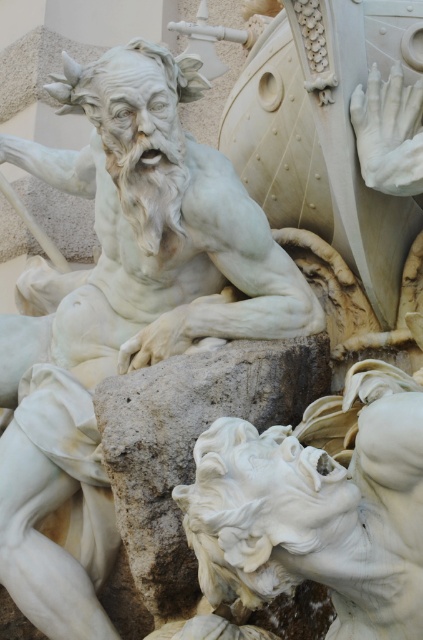
Does point (235, 276) come behind point (302, 390)?

Yes, it is.

Is white marble statue at center bigger than white marble stone at center?

Correct, white marble statue at center is larger in size than white marble stone at center.

The image size is (423, 640). Find the location of `white marble statue at center`. white marble statue at center is located at coordinates (123, 312).

Locate an element on the screen. white marble statue at center is located at coordinates (123, 312).